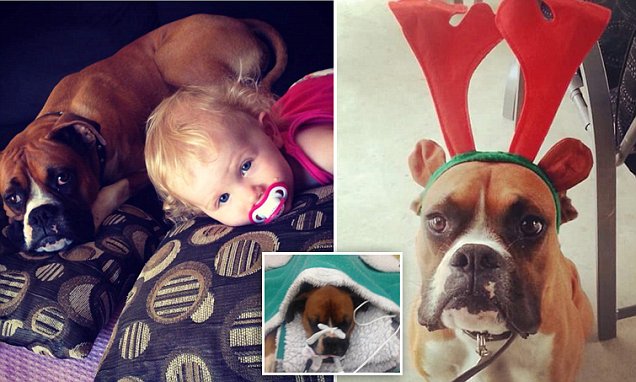
The width and height of the screenshot is (636, 382). Identify the location of pacifier. (275, 209).